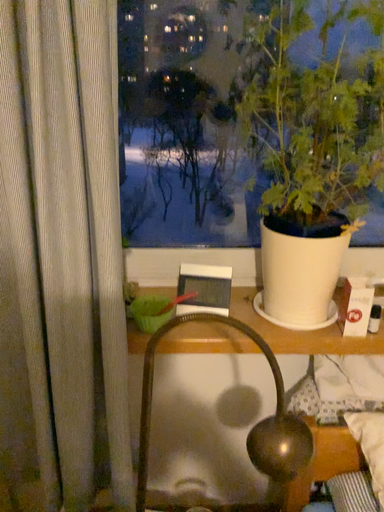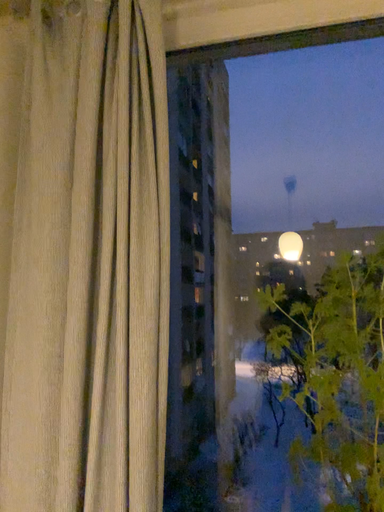
Question: Which way did the camera rotate in the video?

Choices:
 (A) rotated left
 (B) rotated right

Answer: (A)